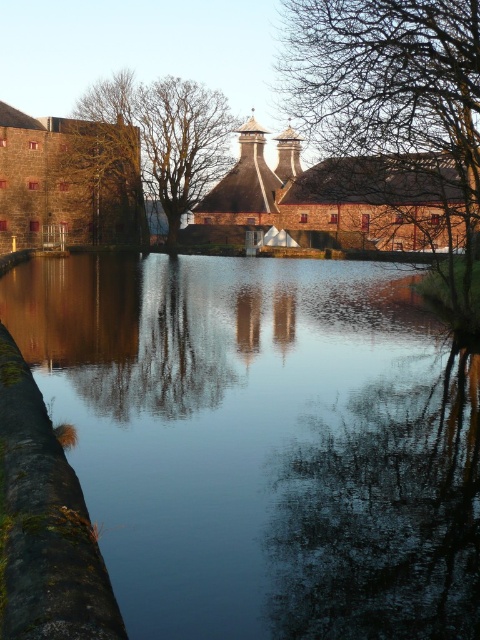
You are an architect analyzing the symmetry of the scene. Given the brown wood tree at upper left and the bare wood tree at center, which one is taller?

The brown wood tree at upper left is taller than the bare wood tree at center.

You are standing in the serene scene and notice two trees in the distance. The first is the bare branches at upper center, and the second is the brown wood tree at upper left. From your vantage point, which tree is positioned more to the left?

The brown wood tree at upper left is positioned more to the left compared to the bare branches at upper center, as the bare branches at upper center are located to the right of the brown wood tree at upper left.

From the picture: You are standing at the edge of the large body of water in the serene scene. There is a point marked at coordinates (x=263, y=442). What is the nature of the surface at this point?

The point at coordinates (x=263, y=442) is part of the smooth reflective water at center, which creates a mirror image of the surrounding structures and trees.